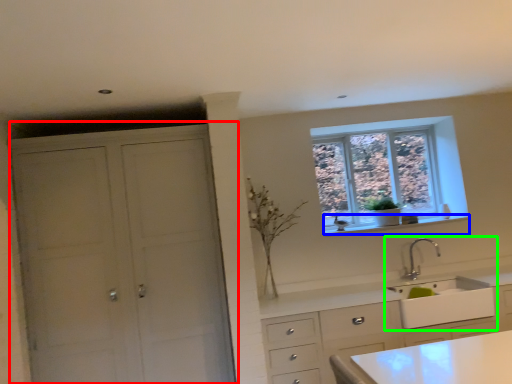
Question: Which object is the farthest from cupboard (highlighted by a red box)? Choose among these: window sill (highlighted by a blue box) or sink (highlighted by a green box).

Choices:
 (A) window sill
 (B) sink

Answer: (B)